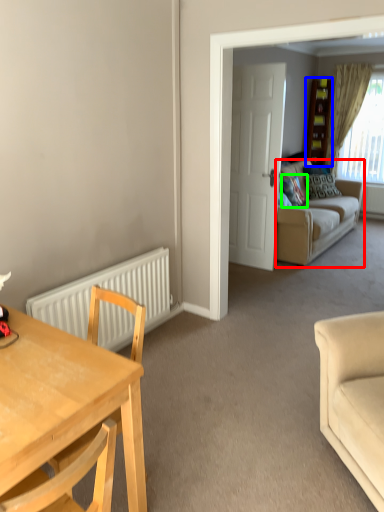
Question: Based on their relative distances, which object is nearer to studio couch (highlighted by a red box)? Choose from cabinetry (highlighted by a blue box) and pillow (highlighted by a green box).

Choices:
 (A) cabinetry
 (B) pillow

Answer: (B)